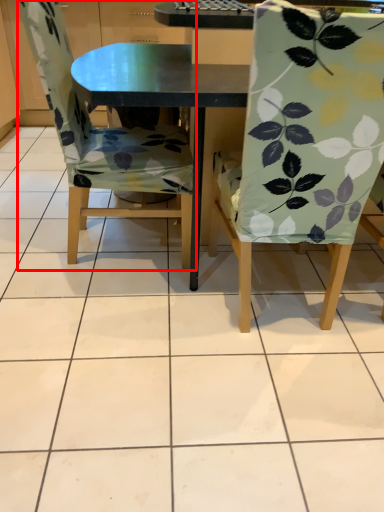
Question: In this image, where is chair (annotated by the red box) located relative to chair?

Choices:
 (A) right
 (B) left

Answer: (B)